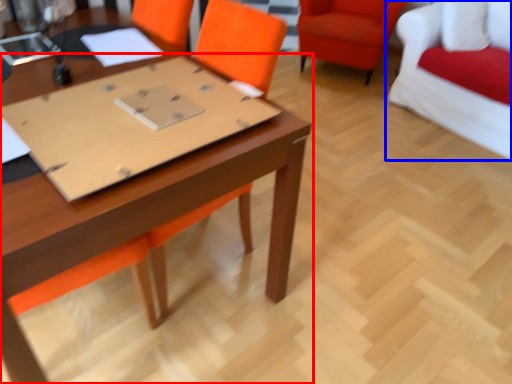
Question: Among these objects, which one is nearest to the camera, table (highlighted by a red box) or chair (highlighted by a blue box)?

Choices:
 (A) table
 (B) chair

Answer: (A)